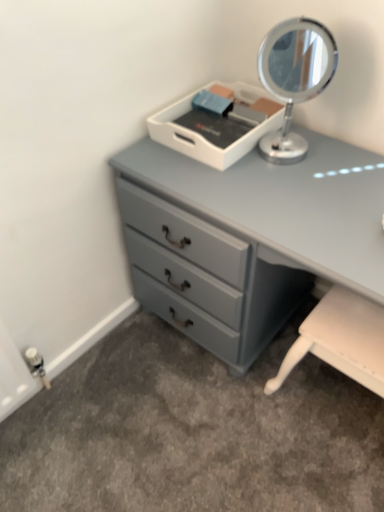
I want to click on vacant space underneath silver metallic mirror at upper right (from a real-world perspective), so click(287, 157).